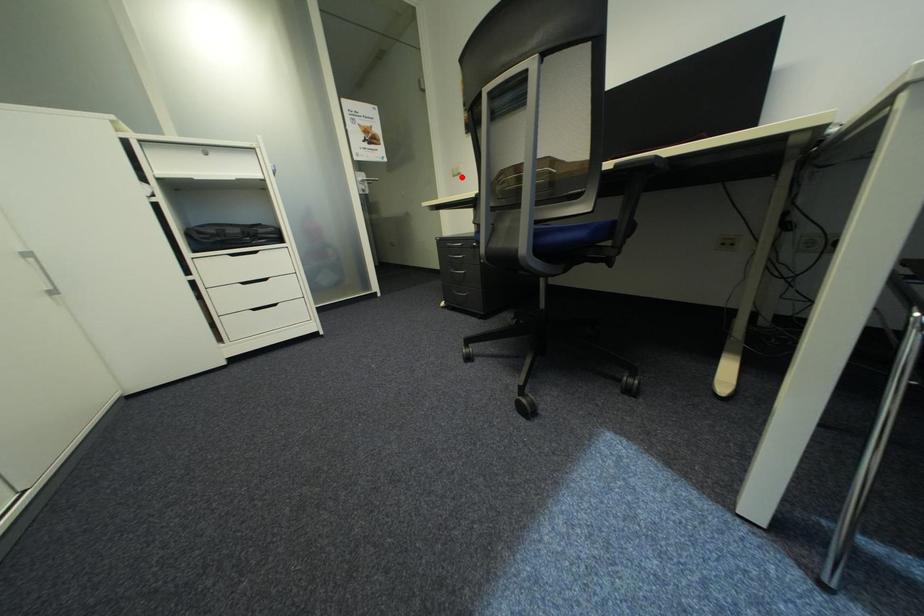
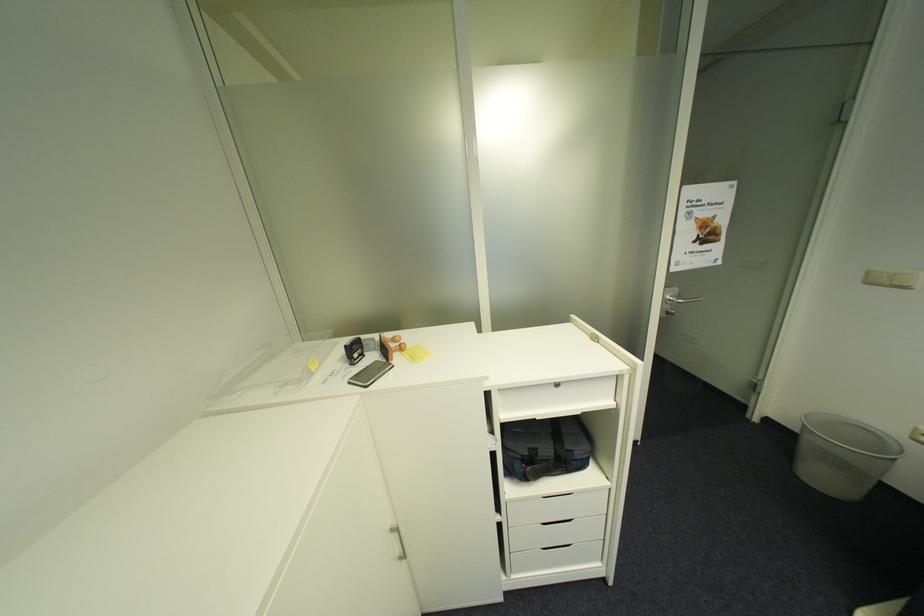
The point at the highlighted location is marked in the first image. Where is the corresponding point in the second image?

(876, 284)